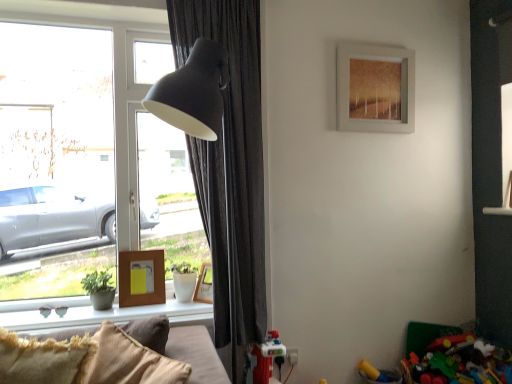
Based on the photo, what is the approximate height of green matte plant at lower left?

18.12 centimeters.

What is the approximate width of matte brown picture frame at upper center, arranged as the 3th picture frame when viewed from the left?

2.82 inches.

I want to click on matte brown picture frame at upper center, which is counted as the 1th picture frame, starting from the top, so click(375, 89).

The height and width of the screenshot is (384, 512). Identify the location of wooden photo frame at lower left, the second picture frame positioned from the left. (204, 285).

Based on the photo, what is the approximate height of woodenobject at lower left, the 3th picture frame positioned from the right?

The height of woodenobject at lower left, the 3th picture frame positioned from the right, is 11.57 inches.

In order to click on transparent glass window at left in this screenshot , I will do `click(85, 159)`.

The height and width of the screenshot is (384, 512). What do you see at coordinates (86, 313) in the screenshot?
I see `smooth concrete window sill at lower left` at bounding box center [86, 313].

Identify the location of green matte plant at lower left. This screenshot has width=512, height=384. (99, 289).

From the image's perspective, which is below, smooth concrete window sill at lower left or velvet beige couch at lower left?

smooth concrete window sill at lower left.

Does point (176, 311) appear closer or farther from the camera than point (204, 381)?

Point (176, 311) is positioned farther from the camera compared to point (204, 381).

Is smooth concrete window sill at lower left positioned before velvet beige couch at lower left?

No, the depth of smooth concrete window sill at lower left is greater than that of velvet beige couch at lower left.

Identify the location of window sill located below the velvet beige couch at lower left (from the image's perspective). (86, 313).

From a real-world perspective, who is located higher, woodenobject at lower left, the 3th picture frame positioned from the right, or transparent glass window at left?

transparent glass window at left is physically above.

Looking at this image, is woodenobject at lower left, the 3th picture frame positioned from the right, to the left of transparent glass window at left from the viewer's perspective?

No, woodenobject at lower left, the 3th picture frame positioned from the right, is not to the left of transparent glass window at left.

Are woodenobject at lower left, the 3th picture frame positioned from the right, and transparent glass window at left located far from each other?

Actually, woodenobject at lower left, the 3th picture frame positioned from the right, and transparent glass window at left are a little close together.

How distant is woodenobject at lower left, which is the first picture frame from left to right, from transparent glass window at left?

woodenobject at lower left, which is the first picture frame from left to right, is 19.07 inches away from transparent glass window at left.

In the scene shown: From the image's perspective, is velvet beige couch at lower left located above smooth concrete window sill at lower left?

Yes, from the image's perspective, velvet beige couch at lower left is above smooth concrete window sill at lower left.

Is velvet beige couch at lower left next to smooth concrete window sill at lower left?

There is a gap between velvet beige couch at lower left and smooth concrete window sill at lower left.

Is velvet beige couch at lower left smaller than smooth concrete window sill at lower left?

Incorrect, velvet beige couch at lower left is not smaller in size than smooth concrete window sill at lower left.

From a real-world perspective, who is located lower, velvet beige couch at lower left or smooth concrete window sill at lower left?

smooth concrete window sill at lower left.

Is wooden photo frame at lower left, which is counted as the first picture frame, starting from the bottom, positioned behind velvet beige couch at lower left?

Yes, wooden photo frame at lower left, which is counted as the first picture frame, starting from the bottom, is further from the viewer.

Consider the image. Considering the sizes of wooden photo frame at lower left, which is counted as the first picture frame, starting from the bottom, and velvet beige couch at lower left in the image, is wooden photo frame at lower left, which is counted as the first picture frame, starting from the bottom, wider or thinner than velvet beige couch at lower left?

In the image, wooden photo frame at lower left, which is counted as the first picture frame, starting from the bottom, appears to be more narrow than velvet beige couch at lower left.

Who is bigger, wooden photo frame at lower left, which is counted as the first picture frame, starting from the bottom, or velvet beige couch at lower left?

Bigger between the two is velvet beige couch at lower left.

Can we say wooden photo frame at lower left, the second picture frame positioned from the left, lies outside velvet beige couch at lower left?

Absolutely, wooden photo frame at lower left, the second picture frame positioned from the left, is external to velvet beige couch at lower left.

Is point (142, 262) positioned in front of point (94, 296)?

No, it is behind (94, 296).

How different are the orientations of woodenobject at lower left, arranged as the 2th picture frame when viewed from the top, and green matte plant at lower left in degrees?

There is a 0.000125-degree angle between the facing directions of woodenobject at lower left, arranged as the 2th picture frame when viewed from the top, and green matte plant at lower left.

In order to click on houseplant lying in front of the woodenobject at lower left, arranged as the 2th picture frame when viewed from the top in this screenshot , I will do `click(99, 289)`.

Is woodenobject at lower left, which is the first picture frame from left to right, at the right side of green matte plant at lower left?

Yes, woodenobject at lower left, which is the first picture frame from left to right, is to the right of green matte plant at lower left.

Visually, is dark grey fabric curtain at left positioned to the left or to the right of green matte plant at lower left?

Clearly, dark grey fabric curtain at left is on the right of green matte plant at lower left in the image.

From the image's perspective, is dark grey fabric curtain at left located above or below green matte plant at lower left?

Based on their image positions, dark grey fabric curtain at left is located above green matte plant at lower left.

Looking at this image, from a real-world perspective, between dark grey fabric curtain at left and green matte plant at lower left, who is vertically higher?

From a 3D spatial view, dark grey fabric curtain at left is above.

Considering the sizes of objects dark grey fabric curtain at left and green matte plant at lower left in the image provided, who is wider, dark grey fabric curtain at left or green matte plant at lower left?

Wider between the two is dark grey fabric curtain at left.

Is the surface of green matte plant at lower left in direct contact with velvet beige couch at lower left?

No, green matte plant at lower left is not next to velvet beige couch at lower left.

In the scene shown: Is green matte plant at lower left aimed at velvet beige couch at lower left?

Yes, green matte plant at lower left is oriented towards velvet beige couch at lower left.

From the picture: Is green matte plant at lower left in front of or behind velvet beige couch at lower left in the image?

In the image, green matte plant at lower left appears behind velvet beige couch at lower left.

Considering the sizes of objects green matte plant at lower left and velvet beige couch at lower left in the image provided, who is taller, green matte plant at lower left or velvet beige couch at lower left?

velvet beige couch at lower left.

In order to click on window sill that is below the velvet beige couch at lower left (from the image's perspective) in this screenshot , I will do `click(86, 313)`.

Find the location of `window lying in front of the woodenobject at lower left, the 3th picture frame positioned from the right`. window lying in front of the woodenobject at lower left, the 3th picture frame positioned from the right is located at coordinates (85, 159).

Which object lies further to the anchor point matte brown picture frame at upper center, marked as the 1th picture frame in a right-to-left arrangement, velvet beige couch at lower left or woodenobject at lower left, the 3th picture frame positioned from the right?

Among the two, velvet beige couch at lower left is located further to matte brown picture frame at upper center, marked as the 1th picture frame in a right-to-left arrangement.

Which object lies further to the anchor point dark grey fabric curtain at left, velvet beige couch at lower left or transparent glass window at left?

velvet beige couch at lower left lies further to dark grey fabric curtain at left than the other object.

From the image, which object appears to be nearer to dark grey fabric curtain at left, wooden photo frame at lower left, the 2th picture frame positioned from the right, or green matte plant at lower left?

wooden photo frame at lower left, the 2th picture frame positioned from the right, is closer to dark grey fabric curtain at left.

Looking at the image, which one is located further to velvet beige couch at lower left, wooden photo frame at lower left, the third picture frame when ordered from top to bottom, or green matte plant at lower left?

The object further to velvet beige couch at lower left is wooden photo frame at lower left, the third picture frame when ordered from top to bottom.

Based on the photo, which object lies nearer to the anchor point velvet beige couch at lower left, green matte plant at lower left or dark grey fabric curtain at left?

Among the two, green matte plant at lower left is located nearer to velvet beige couch at lower left.

Looking at the image, which one is located closer to wooden photo frame at lower left, which is counted as the first picture frame, starting from the bottom, woodenobject at lower left, which is the first picture frame from left to right, or velvet beige couch at lower left?

woodenobject at lower left, which is the first picture frame from left to right.

Considering their positions, is transparent glass window at left positioned further to smooth concrete window sill at lower left than velvet beige couch at lower left?

transparent glass window at left is positioned further to the anchor smooth concrete window sill at lower left.

Based on their spatial positions, is velvet beige couch at lower left or dark grey fabric curtain at left further from matte brown picture frame at upper center, marked as the 1th picture frame in a right-to-left arrangement?

velvet beige couch at lower left.

The height and width of the screenshot is (384, 512). I want to click on window sill positioned between velvet beige couch at lower left and woodenobject at lower left, which is the first picture frame from left to right, from near to far, so click(x=86, y=313).

I want to click on curtain between velvet beige couch at lower left and matte brown picture frame at upper center, which is counted as the 1th picture frame, starting from the top, so click(230, 168).

At what (x,y) coordinates should I click in order to perform the action: click on window sill between transparent glass window at left and dark grey fabric curtain at left in the horizontal direction. Please return your answer as a coordinate pair (x, y). Image resolution: width=512 pixels, height=384 pixels. Looking at the image, I should click on (86, 313).

Image resolution: width=512 pixels, height=384 pixels. I want to click on window sill between transparent glass window at left and matte brown picture frame at upper center, marked as the 1th picture frame in a right-to-left arrangement, so click(x=86, y=313).